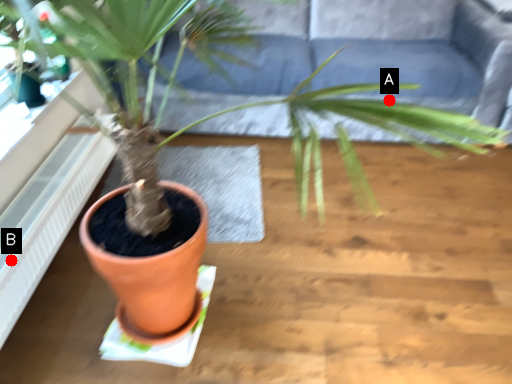
Question: Two points are circled on the image, labeled by A and B beside each circle. Which point is further to the camera?

Choices:
 (A) A is further
 (B) B is further

Answer: (A)